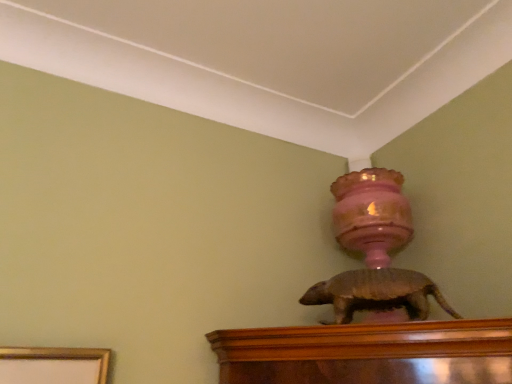
Identify the location of brown matte tortoise at center. (376, 293).

The height and width of the screenshot is (384, 512). What do you see at coordinates (376, 293) in the screenshot?
I see `brown matte tortoise at center` at bounding box center [376, 293].

You are a GUI agent. You are given a task and a screenshot of the screen. Output one action in this format:
    pyautogui.click(x=<x>, y=<y>)
    Task: Click on the brown matte tortoise at center
    
    Given the screenshot: What is the action you would take?
    pyautogui.click(x=376, y=293)